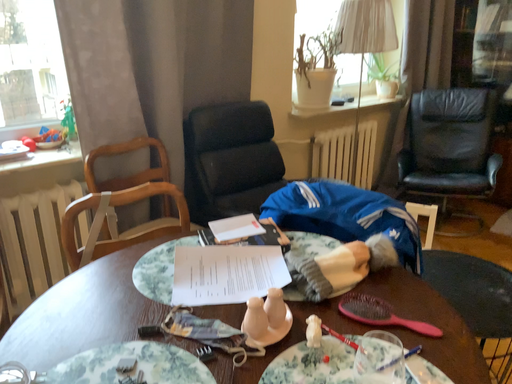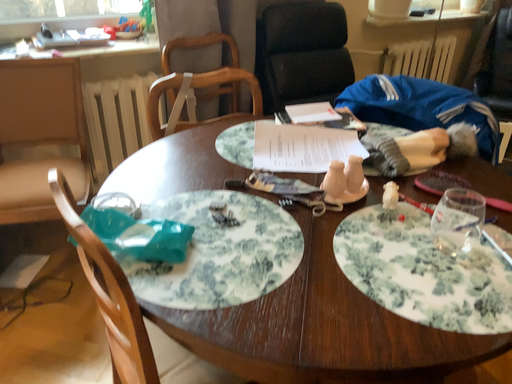
Question: Which way did the camera rotate in the video?

Choices:
 (A) rotated upward
 (B) rotated downward

Answer: (B)